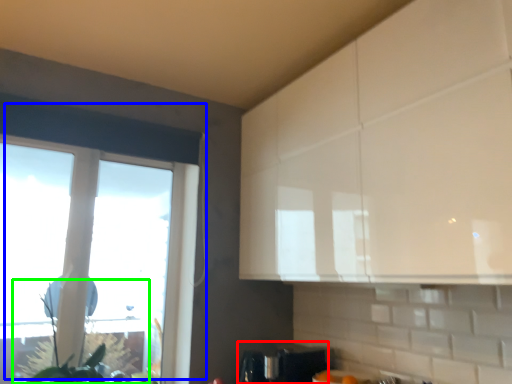
Question: Estimate the real-world distances between objects in this image. Which object is closer to appliance (highlighted by a red box), window (highlighted by a blue box) or plant (highlighted by a green box)?

Choices:
 (A) window
 (B) plant

Answer: (A)